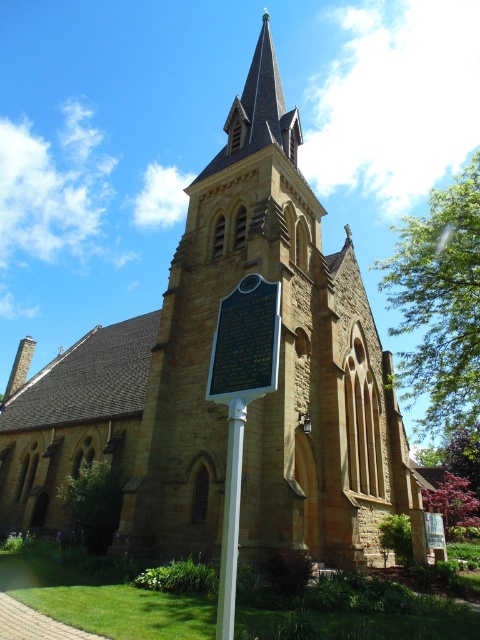
You are standing in front of the historic church and want to take a photo that includes both the spire and the signpost. The spire is located at point (235, 369) and the signpost at point (216, 625). Since you want both in focus, which point should you focus on to ensure both are sharp?

You should focus on point (235, 369) because it is closer to the camera than point (216, 625). Focusing on the closer point will ensure both are in focus.

You are a tour guide preparing to give a talk about the historic church. You want to point out the silver metallic plaque at center and the white plastic pole at center to your audience. Which object should you mention first if you want to start with the smaller one?

The silver metallic plaque at center is smaller than the white plastic pole at center, so you should mention the silver metallic plaque at center first.